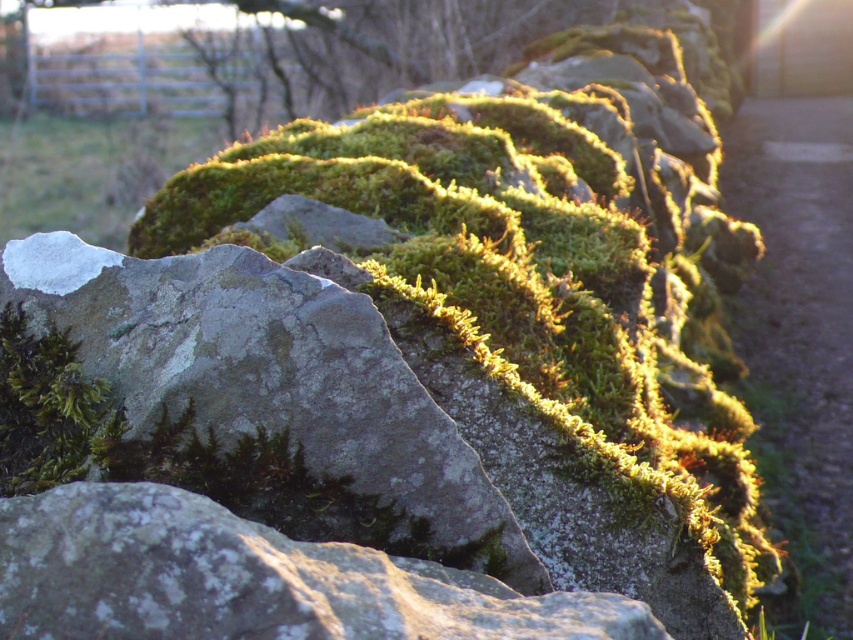
Who is positioned more to the right, speckled gray rock at center or green mossy rock at upper left?

speckled gray rock at center

Does speckled gray rock at center have a larger size compared to green mossy rock at upper left?

Actually, speckled gray rock at center might be smaller than green mossy rock at upper left.

Does point (427, 605) lie in front of point (68, 156)?

Yes, it is in front of point (68, 156).

At what (x,y) coordinates should I click in order to perform the action: click on speckled gray rock at center. Please return your answer as a coordinate pair (x, y). This screenshot has height=640, width=853. Looking at the image, I should click on (250, 579).

Does point (842, 241) lie behind point (321, 90)?

That is False.

Is green mossy stone at lower right smaller than green mossy rock at upper center?

No, green mossy stone at lower right is not smaller than green mossy rock at upper center.

Locate an element on the screen. green mossy stone at lower right is located at coordinates (799, 336).

Between green mossy rock at center and green mossy rock at upper center, which one has more height?

Standing taller between the two is green mossy rock at center.

Is the position of green mossy rock at center less distant than that of green mossy rock at upper center?

Yes, it is in front of green mossy rock at upper center.

Is point (659, 337) positioned behind point (457, 65)?

No.

The image size is (853, 640). What are the coordinates of `green mossy rock at center` in the screenshot? It's located at (521, 332).